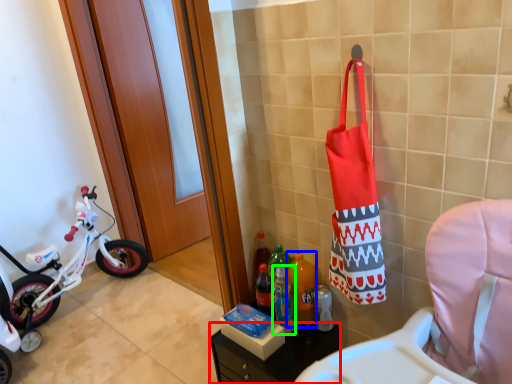
Question: Estimate the real-world distances between objects in this image. Which object is farther from furniture (highlighted by a red box), bottle (highlighted by a blue box) or bottle (highlighted by a green box)?

Choices:
 (A) bottle
 (B) bottle

Answer: (A)